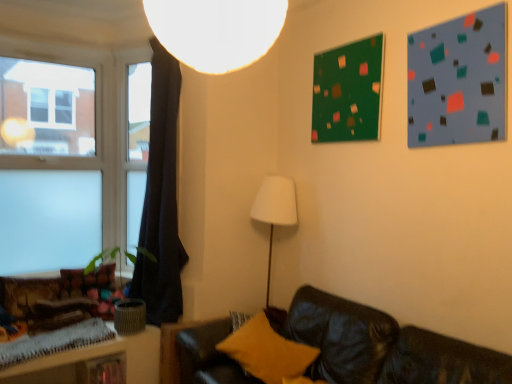
Question: Would you say dark fabric curtain at left is to the left or to the right of matte blue bulletin board at upper right, positioned as the first bulletin board in front-to-back order, in the picture?

Choices:
 (A) left
 (B) right

Answer: (A)

Question: Relative to matte blue bulletin board at upper right, positioned as the first bulletin board in front-to-back order, is dark fabric curtain at left in front or behind?

Choices:
 (A) behind
 (B) front

Answer: (A)

Question: Which is farther from the dark fabric curtain at left?

Choices:
 (A) transparent glass window at left
 (B) matte blue bulletin board at upper right, the 1th bulletin board viewed from the right
 (C) velvet textured pillow at lower left, the 2th pillow viewed from the front
 (D) wooden textured table at lower left
 (E) yellow fuzzy pillow at lower center, positioned as the first pillow in front-to-back order

Answer: (B)

Question: Based on their relative distances, which object is nearer to the velvet textured pillow at lower left, the 2th pillow viewed from the front?

Choices:
 (A) white matte lampshade at upper center
 (B) green matte bulletin board at upper center, which appears as the 1th bulletin board when viewed from the back
 (C) matte blue bulletin board at upper right, the second bulletin board in the back-to-front sequence
 (D) transparent glass window at left
 (E) dark fabric curtain at left

Answer: (E)